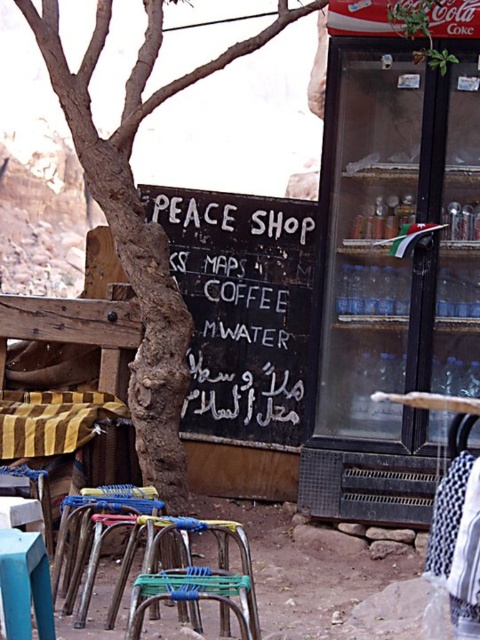
Does black chalkboard at center come in front of metallic blue chair at lower center?

No, black chalkboard at center is further to the viewer.

Does black chalkboard at center appear under metallic blue chair at lower center?

No, black chalkboard at center is not below metallic blue chair at lower center.

The width and height of the screenshot is (480, 640). What do you see at coordinates (241, 307) in the screenshot? I see `black chalkboard at center` at bounding box center [241, 307].

Find the location of `black chalkboard at center`. black chalkboard at center is located at coordinates (241, 307).